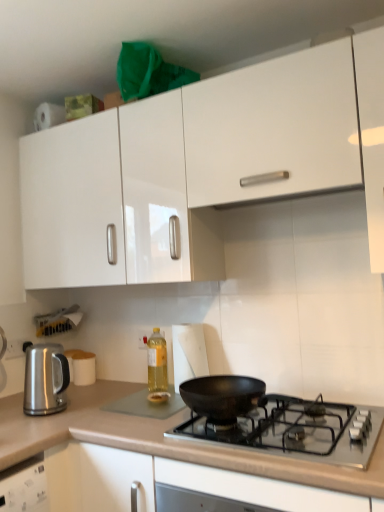
Question: Should I look upward or downward to see smooth beige countertop at lower center?

Choices:
 (A) down
 (B) up

Answer: (A)

Question: Does white matte cup at center-left have a lesser height compared to white paper towel at center?

Choices:
 (A) yes
 (B) no

Answer: (A)

Question: From a real-world perspective, is white matte cup at center-left below white paper towel at center?

Choices:
 (A) no
 (B) yes

Answer: (B)

Question: Does white matte cup at center-left have a larger size compared to white paper towel at center?

Choices:
 (A) no
 (B) yes

Answer: (A)

Question: Can you confirm if white matte cup at center-left is smaller than white paper towel at center?

Choices:
 (A) no
 (B) yes

Answer: (B)

Question: Can you confirm if white matte cup at center-left is positioned to the left of white paper towel at center?

Choices:
 (A) no
 (B) yes

Answer: (B)

Question: From a real-world perspective, does white matte cup at center-left stand above white paper towel at center?

Choices:
 (A) yes
 (B) no

Answer: (B)

Question: From a real-world perspective, is translucent yellow liquid at center located higher than white paper towel at center?

Choices:
 (A) no
 (B) yes

Answer: (A)

Question: Considering the relative positions of translucent yellow liquid at center and white paper towel at center in the image provided, is translucent yellow liquid at center to the right of white paper towel at center from the viewer's perspective?

Choices:
 (A) no
 (B) yes

Answer: (A)

Question: Does translucent yellow liquid at center have a larger size compared to white paper towel at center?

Choices:
 (A) no
 (B) yes

Answer: (A)

Question: Is translucent yellow liquid at center thinner than white paper towel at center?

Choices:
 (A) yes
 (B) no

Answer: (A)

Question: Is translucent yellow liquid at center shorter than white paper towel at center?

Choices:
 (A) no
 (B) yes

Answer: (B)

Question: Are translucent yellow liquid at center and white paper towel at center far apart?

Choices:
 (A) yes
 (B) no

Answer: (B)

Question: From a real-world perspective, is white matte cup at center-left located beneath white glossy cabinet at upper center?

Choices:
 (A) yes
 (B) no

Answer: (A)